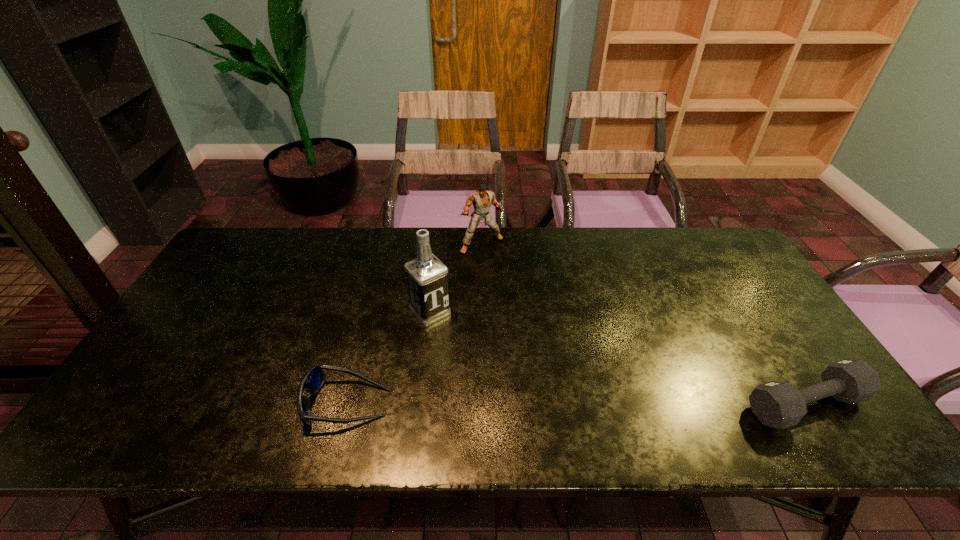
The image size is (960, 540). I want to click on free spot on the desktop that is between the sunglasses and the dumbbell and is positioned on the front label of the third nearest object, so click(x=512, y=403).

I want to click on free space on the desktop that is between the sunglasses and the rightmost object and is positioned on the front-facing side of the puncher, so click(582, 403).